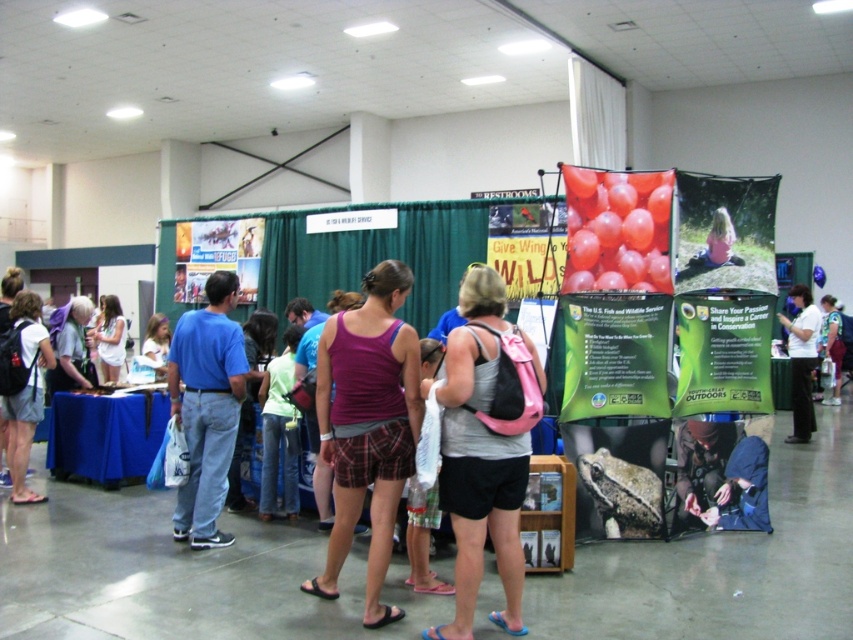
Question: Is gray fabric tank top at center further to the viewer compared to matte black backpack at left?

Choices:
 (A) no
 (B) yes

Answer: (A)

Question: Which point is farther to the camera?

Choices:
 (A) gray fabric tank top at center
 (B) matte purple tank top at center
 (C) white cotton dress at center

Answer: (C)

Question: Does matte black backpack at left have a lesser width compared to matte purple tank top at center?

Choices:
 (A) no
 (B) yes

Answer: (A)

Question: Considering the relative positions of gray fabric tank top at center and matte black backpack at left in the image provided, where is gray fabric tank top at center located with respect to matte black backpack at left?

Choices:
 (A) left
 (B) right

Answer: (B)

Question: Which object is closer to the camera taking this photo?

Choices:
 (A) gray fabric tank top at center
 (B) purple cotton tank top at center

Answer: (A)

Question: Which is farther from the white cotton dress at center?

Choices:
 (A) gray fabric tank top at center
 (B) purple cotton tank top at center
 (C) matte black backpack at left

Answer: (A)